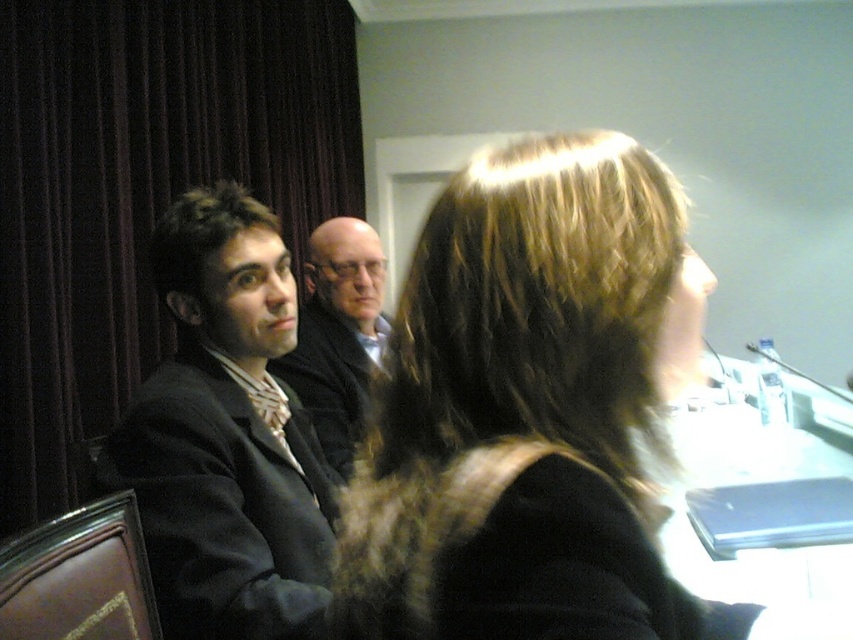
Question: Considering the real-world distances, which object is farthest from the dark brown textured hair at left?

Choices:
 (A) white glossy table at lower right
 (B) matte black suit at center
 (C) matte black suit at left
 (D) shiny brown hair at center

Answer: (A)

Question: Does shiny brown hair at center come in front of white glossy table at lower right?

Choices:
 (A) yes
 (B) no

Answer: (A)

Question: Is shiny brown hair at center behind dark velvet curtain at left?

Choices:
 (A) yes
 (B) no

Answer: (B)

Question: Does matte black suit at left appear under dark brown textured hair at left?

Choices:
 (A) yes
 (B) no

Answer: (A)

Question: Estimate the real-world distances between objects in this image. Which object is closer to the shiny brown hair at center?

Choices:
 (A) matte black suit at center
 (B) dark velvet curtain at left

Answer: (A)

Question: Which of the following is the closest to the observer?

Choices:
 (A) (53, 273)
 (B) (593, 234)
 (C) (297, 419)

Answer: (B)